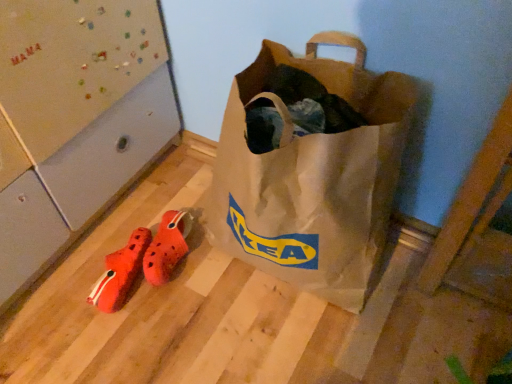
The width and height of the screenshot is (512, 384). Find the location of `vacant space positioned to the left of orange rubber clogs at lower left`. vacant space positioned to the left of orange rubber clogs at lower left is located at coordinates (85, 269).